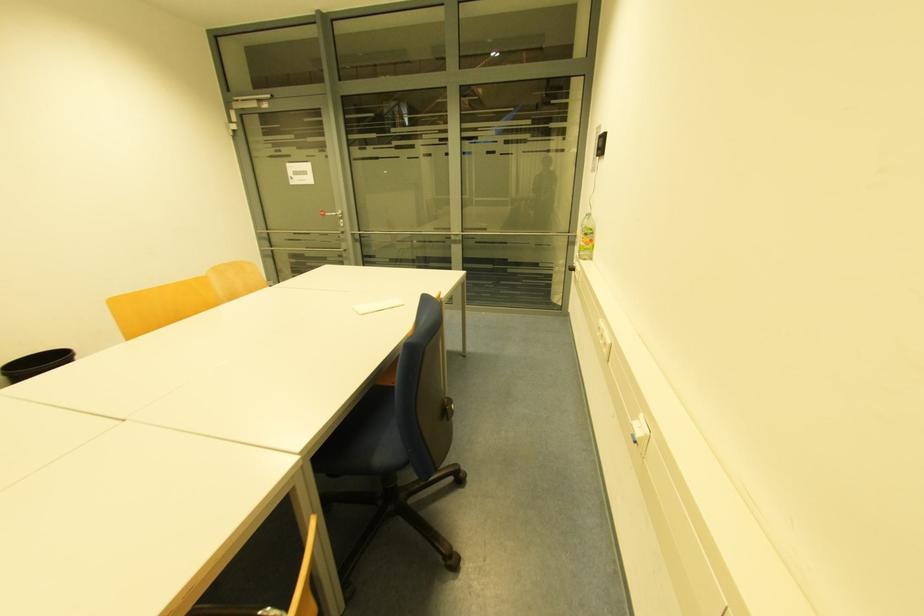
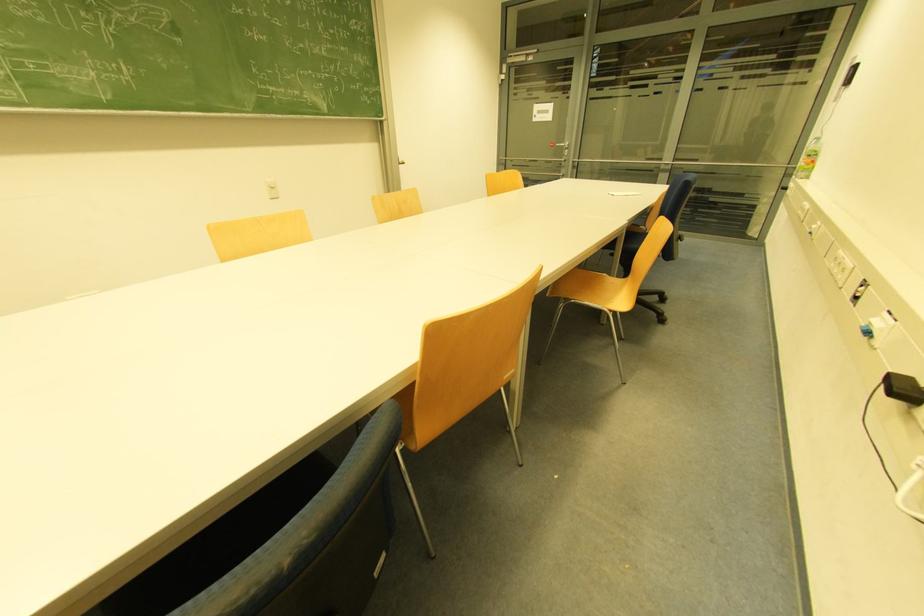
Question: In a continuous first-person perspective shot, in which direction is the camera moving?

Choices:
 (A) Left
 (B) Right
 (C) Forward
 (D) Backward

Answer: (D)